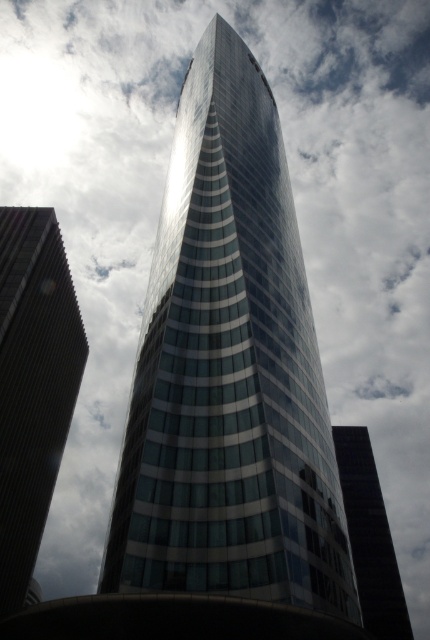
Question: Which point is closer to the camera taking this photo?

Choices:
 (A) (368, 596)
 (B) (67, 326)

Answer: (B)

Question: Among these objects, which one is nearest to the camera?

Choices:
 (A) glassy reflective skyscraper at center
 (B) matte glass skyscraper at left

Answer: (B)

Question: Considering the relative positions of matte glass skyscraper at left and glassy reflective skyscraper at center in the image provided, where is matte glass skyscraper at left located with respect to glassy reflective skyscraper at center?

Choices:
 (A) above
 (B) below

Answer: (A)

Question: Is matte glass skyscraper at left in front of glassy reflective skyscraper at center?

Choices:
 (A) no
 (B) yes

Answer: (B)

Question: Is matte glass skyscraper at left below glassy reflective skyscraper at center?

Choices:
 (A) no
 (B) yes

Answer: (A)